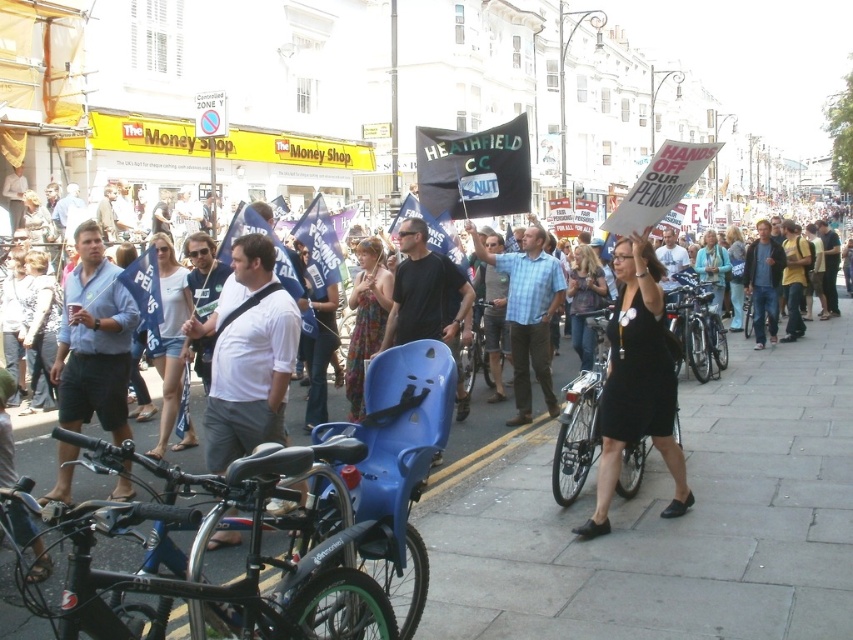
Question: Which is farther from the smooth concrete pavement at center?

Choices:
 (A) silver metallic bicycle at center
 (B) light blue shirt at center
 (C) black matte bicycle at center

Answer: (B)

Question: Does smooth concrete pavement at center have a smaller size compared to black matte bicycle at lower left?

Choices:
 (A) yes
 (B) no

Answer: (B)

Question: Is silver metallic bicycle at center wider than black matte bicycle at center?

Choices:
 (A) yes
 (B) no

Answer: (B)

Question: Does smooth concrete pavement at center have a lesser width compared to silver metallic bicycle at center?

Choices:
 (A) no
 (B) yes

Answer: (A)

Question: Which object is closer to the camera taking this photo?

Choices:
 (A) smooth concrete pavement at center
 (B) black matte bicycle at center
 (C) plaid fabric shirt at center

Answer: (A)

Question: Which point is closer to the camera taking this photo?

Choices:
 (A) (387, 612)
 (B) (480, 364)

Answer: (A)